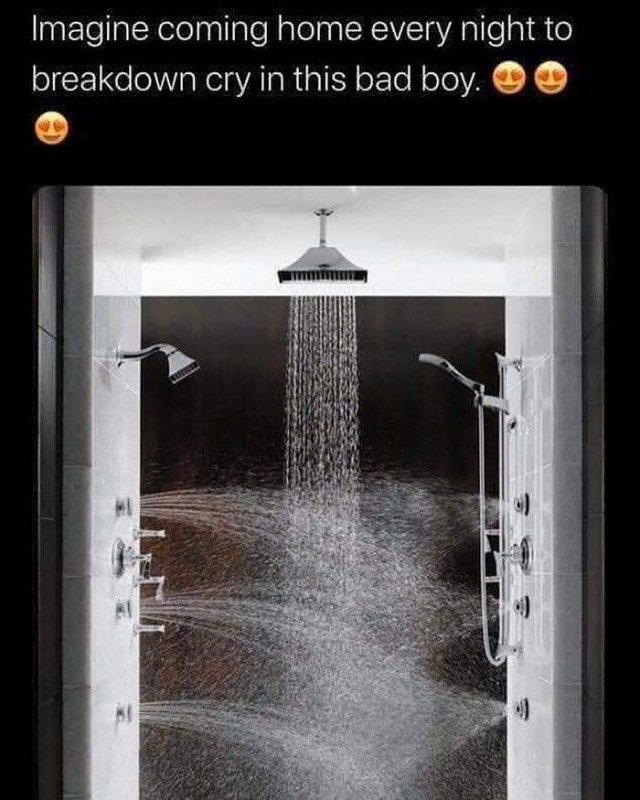
This screenshot has width=640, height=800. I want to click on right shower head, so click(436, 362).